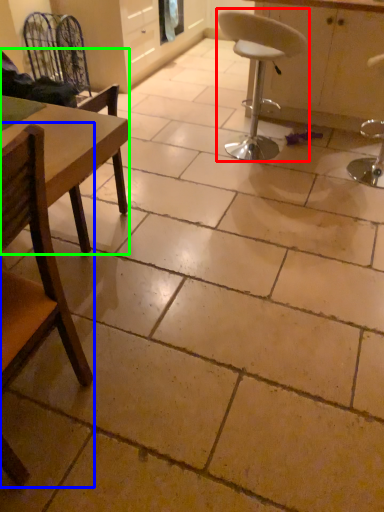
Question: Which object is the farthest from chair (highlighted by a red box)? Choose among these: chair (highlighted by a blue box) or chair (highlighted by a green box).

Choices:
 (A) chair
 (B) chair

Answer: (A)